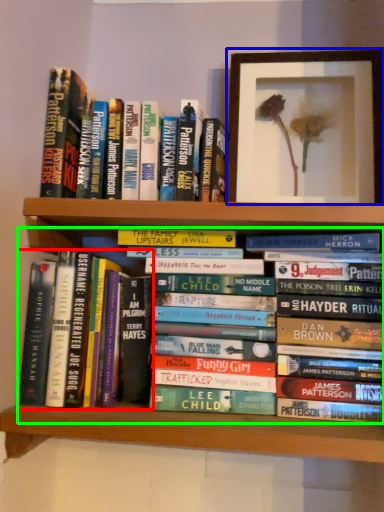
Question: Which object is positioned closest to book (highlighted by a red box)? Select from picture frame (highlighted by a blue box) and book (highlighted by a green box).

Choices:
 (A) picture frame
 (B) book

Answer: (B)